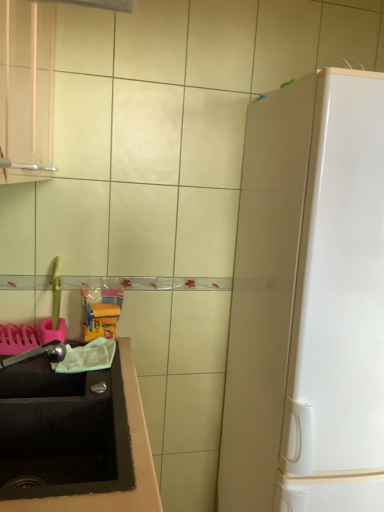
Question: Considering the relative sizes of satin nickel faucet at lower left and black matte sink at lower left in the image provided, is satin nickel faucet at lower left bigger than black matte sink at lower left?

Choices:
 (A) yes
 (B) no

Answer: (B)

Question: Could you tell me if satin nickel faucet at lower left is facing black matte sink at lower left?

Choices:
 (A) no
 (B) yes

Answer: (A)

Question: From the image's perspective, is satin nickel faucet at lower left under black matte sink at lower left?

Choices:
 (A) no
 (B) yes

Answer: (A)

Question: Is satin nickel faucet at lower left further to the viewer compared to black matte sink at lower left?

Choices:
 (A) yes
 (B) no

Answer: (A)

Question: From the image's perspective, is satin nickel faucet at lower left located above black matte sink at lower left?

Choices:
 (A) no
 (B) yes

Answer: (B)

Question: In the image, is black matte sink at lower left on the left side or the right side of satin nickel faucet at lower left?

Choices:
 (A) left
 (B) right

Answer: (B)

Question: From the image's perspective, is black matte sink at lower left positioned above or below satin nickel faucet at lower left?

Choices:
 (A) above
 (B) below

Answer: (B)

Question: From their relative heights in the image, would you say black matte sink at lower left is taller or shorter than satin nickel faucet at lower left?

Choices:
 (A) short
 (B) tall

Answer: (B)

Question: Considering the positions of point (96, 379) and point (46, 355), is point (96, 379) closer or farther from the camera than point (46, 355)?

Choices:
 (A) farther
 (B) closer

Answer: (B)

Question: Is white glossy refrigerator at right inside the boundaries of black matte sink at lower left, or outside?

Choices:
 (A) inside
 (B) outside

Answer: (B)

Question: From the image's perspective, is white glossy refrigerator at right above or below black matte sink at lower left?

Choices:
 (A) above
 (B) below

Answer: (A)

Question: In terms of width, does white glossy refrigerator at right look wider or thinner when compared to black matte sink at lower left?

Choices:
 (A) wide
 (B) thin

Answer: (A)

Question: From their relative heights in the image, would you say white glossy refrigerator at right is taller or shorter than black matte sink at lower left?

Choices:
 (A) short
 (B) tall

Answer: (B)

Question: Considering their positions, is satin nickel faucet at lower left located in front of or behind white glossy refrigerator at right?

Choices:
 (A) behind
 (B) front

Answer: (A)

Question: Is satin nickel faucet at lower left inside the boundaries of white glossy refrigerator at right, or outside?

Choices:
 (A) outside
 (B) inside

Answer: (A)